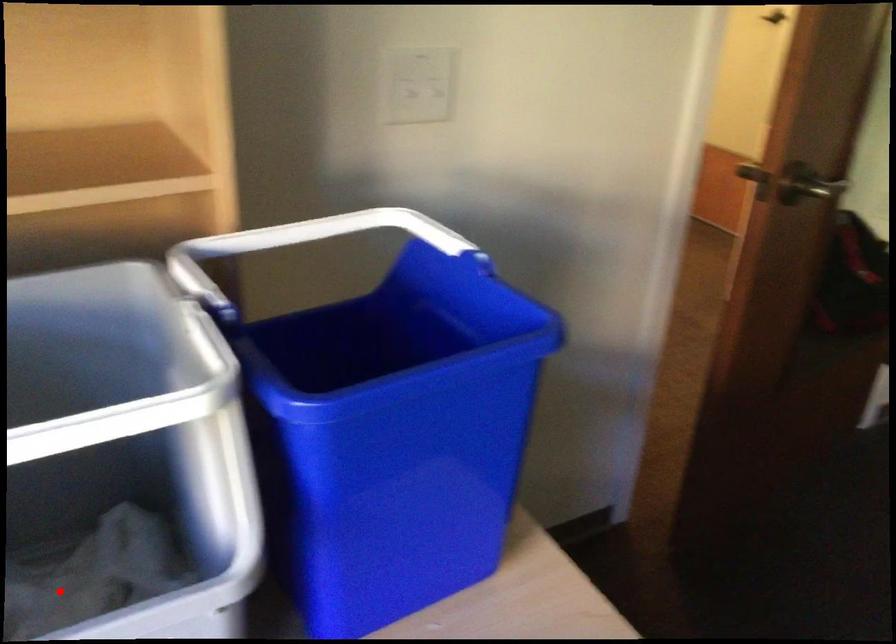
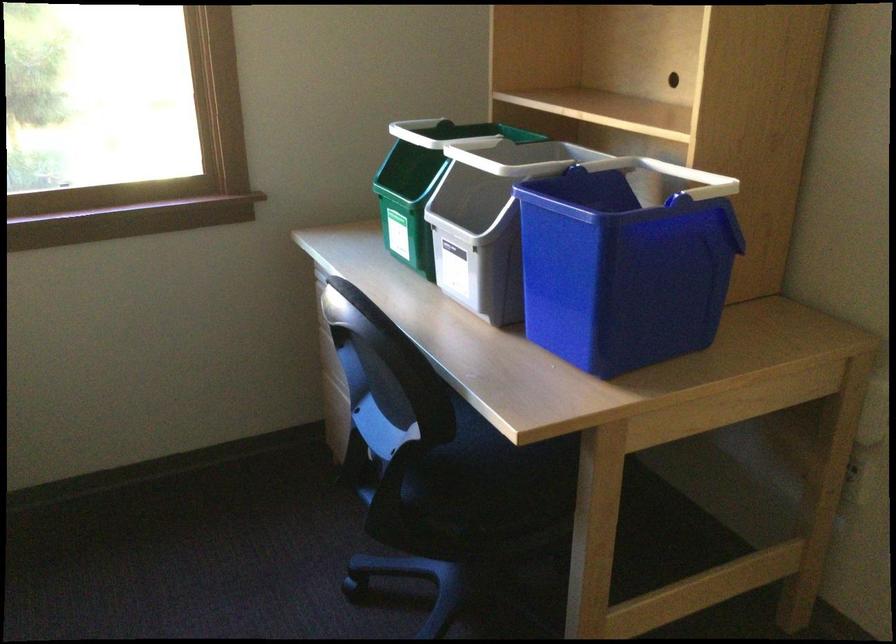
Question: I am providing you with two images of the same scene from different viewpoints. A red point is marked on the first image. Can you still see the location of the red point in image 2?

Choices:
 (A) Yes
 (B) No

Answer: (B)